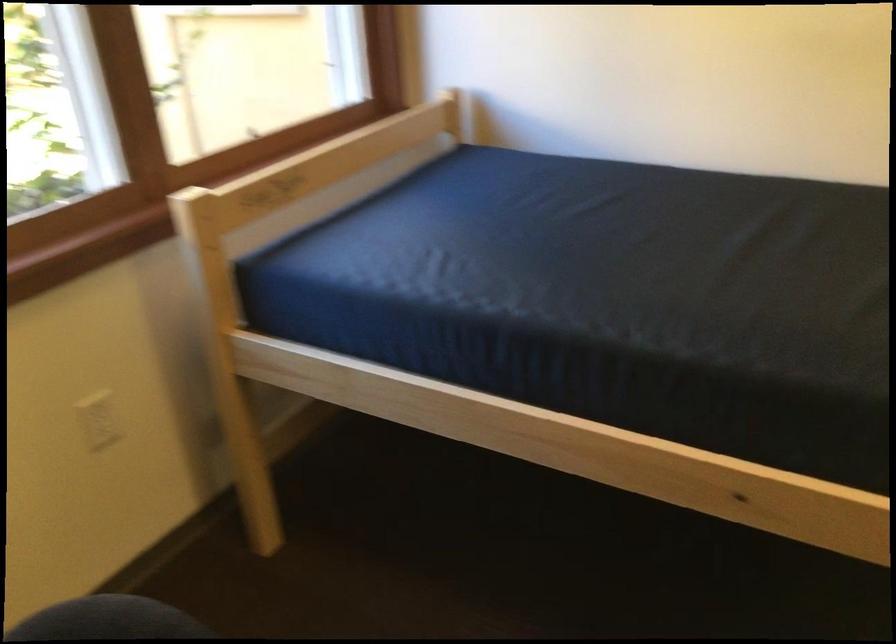
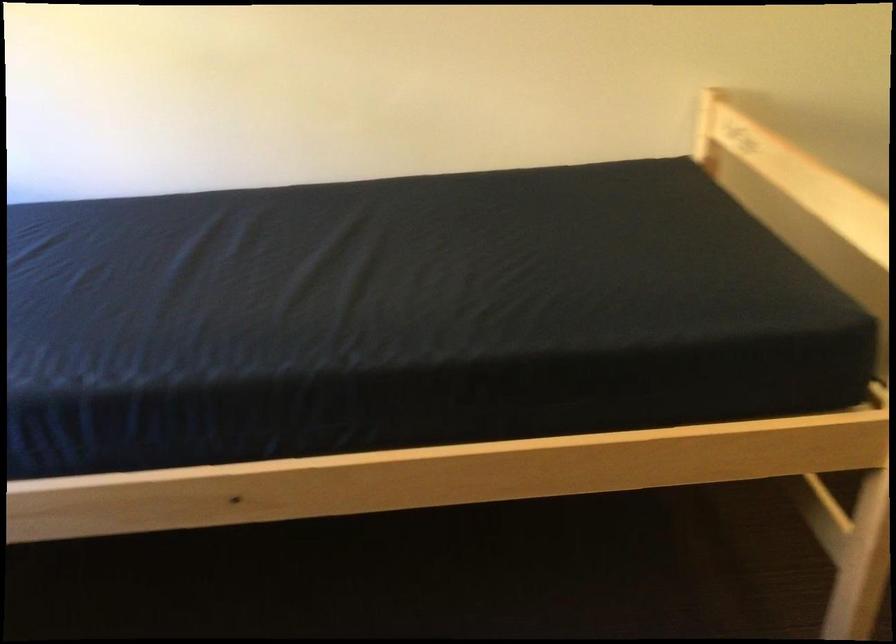
Question: The images are taken continuously from a first-person perspective. In which direction is your viewpoint rotating?

Choices:
 (A) Left
 (B) Right
 (C) Up
 (D) Down

Answer: (B)